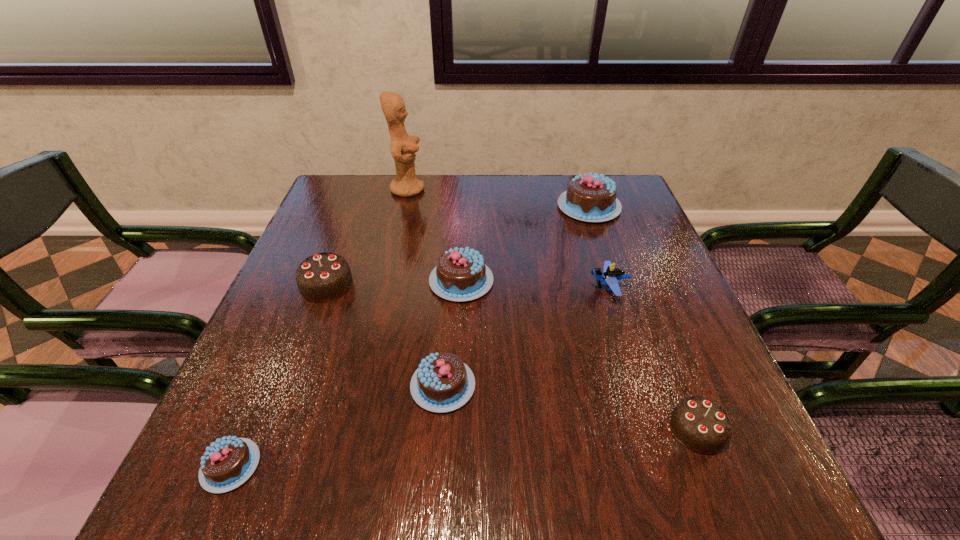
Image resolution: width=960 pixels, height=540 pixels. I want to click on free location located 0.090m on the right of the third biggest pink chocolate cake, so click(x=524, y=386).

Image resolution: width=960 pixels, height=540 pixels. I want to click on vacant space located on the back of the nearer chocolate chocolate cake, so pos(671,365).

The width and height of the screenshot is (960, 540). Identify the location of vacant space located on the right of the nearest pink chocolate cake. (421, 465).

Locate an element on the screen. The image size is (960, 540). figurine present at the far edge is located at coordinates (403, 146).

At what (x,y) coordinates should I click in order to perform the action: click on chocolate cake that is at the far edge. Please return your answer as a coordinate pair (x, y). Image resolution: width=960 pixels, height=540 pixels. Looking at the image, I should click on (592, 198).

Identify the location of Lego that is at the right edge. (611, 275).

Identify the location of object at the near left corner. (226, 464).

Where is `object present at the far right corner`? object present at the far right corner is located at coordinates (592, 198).

In order to click on object situated at the near right corner in this screenshot , I will do `click(700, 424)`.

Locate an element on the screen. The image size is (960, 540). vacant region at the far edge is located at coordinates (432, 201).